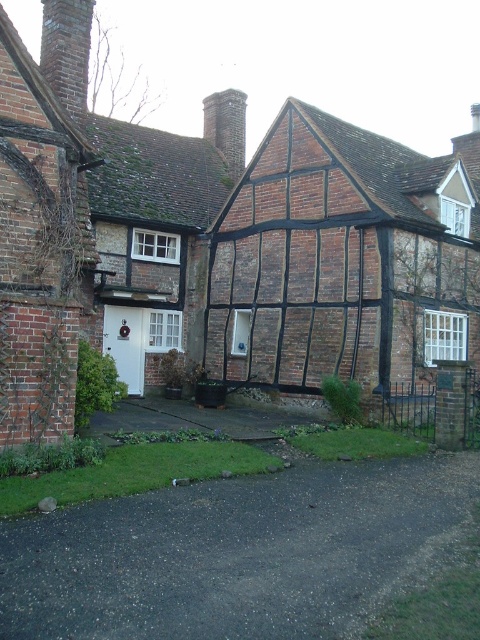
Question: Which point is farther to the camera?

Choices:
 (A) brown brick chimney at upper center
 (B) brick chimney at upper left
 (C) dark gray asphalt driveway at lower center

Answer: (A)

Question: Which point appears farthest from the camera in this image?

Choices:
 (A) (276, 410)
 (B) (217, 102)
 (C) (80, 115)

Answer: (B)

Question: Can you confirm if dark asphalt driveway at lower center is positioned to the left of brown brick chimney at upper center?

Choices:
 (A) no
 (B) yes

Answer: (A)

Question: Estimate the real-world distances between objects in this image. Which object is farther from the dark gray asphalt driveway at lower center?

Choices:
 (A) dark asphalt driveway at lower center
 (B) brick chimney at upper left
 (C) brown brick chimney at upper center

Answer: (C)

Question: Is dark asphalt driveway at lower center smaller than dark gray asphalt driveway at lower center?

Choices:
 (A) yes
 (B) no

Answer: (B)

Question: Can you confirm if dark asphalt driveway at lower center is positioned below brick chimney at upper left?

Choices:
 (A) no
 (B) yes

Answer: (B)